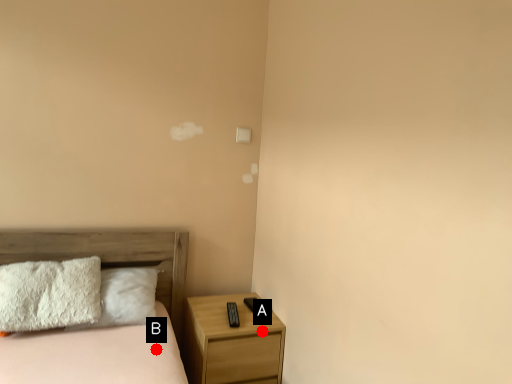
Question: Two points are circled on the image, labeled by A and B beside each circle. Which of the following is the closest to the observer?

Choices:
 (A) A is closer
 (B) B is closer

Answer: (B)